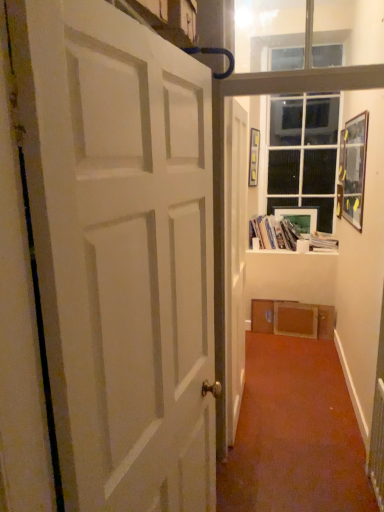
Question: Is white plastic radiator at lower right situated inside matte plastic picture frame at upper center, which is the first picture frame from back to front, or outside?

Choices:
 (A) outside
 (B) inside

Answer: (A)

Question: Based on their sizes in the image, would you say white plastic radiator at lower right is bigger or smaller than matte plastic picture frame at upper center, which is the first picture frame from back to front?

Choices:
 (A) big
 (B) small

Answer: (A)

Question: Based on their relative distances, which object is nearer to the white matte door at center, acting as the second door starting from the front?

Choices:
 (A) white matte door at left, which is counted as the second door, starting from the back
 (B) white glossy bookshelf at upper center, which is counted as the second book, starting from the right
 (C) wooden picture frame at upper right, marked as the second picture frame in a back-to-front arrangement
 (D) matte plastic picture frame at upper center, the 2th picture frame positioned from the front
 (E) white plastic radiator at lower right

Answer: (E)

Question: Which of these objects is positioned closest to the white matte door at left, which ranks as the second door in right-to-left order?

Choices:
 (A) white paper stack at upper right, the 2th book viewed from the left
 (B) white glass window at upper center
 (C) white matte door at center, the 1th door from the right
 (D) wooden picture frame at upper right, marked as the second picture frame in a back-to-front arrangement
 (E) matte plastic picture frame at upper center, which is the first picture frame from back to front

Answer: (C)